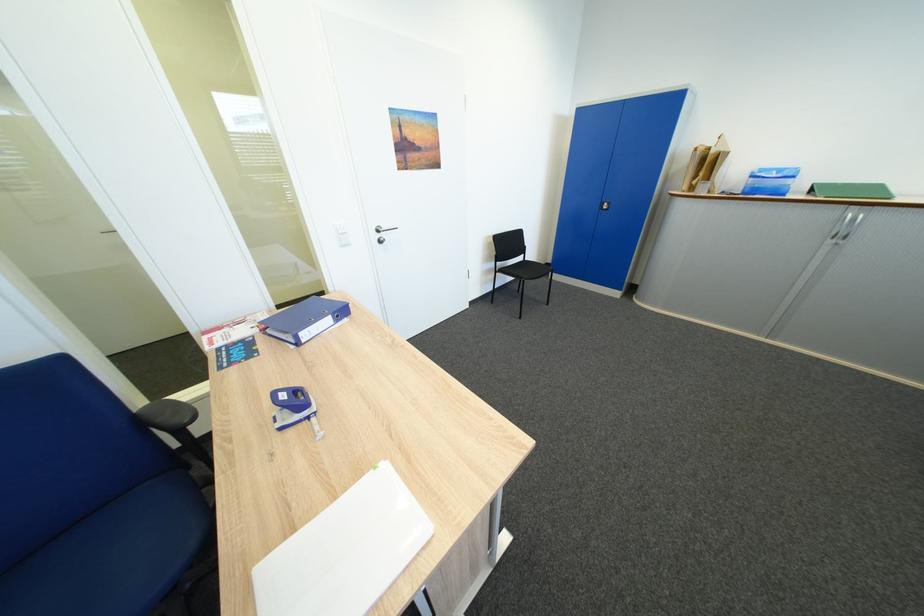
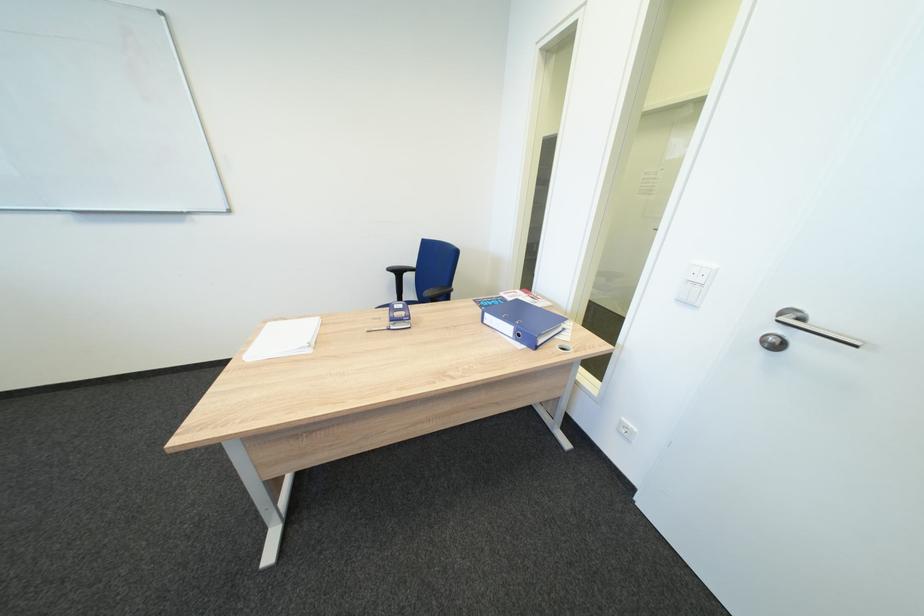
Locate, in the second image, the point that corresponds to point (392, 243) in the first image.

(784, 346)